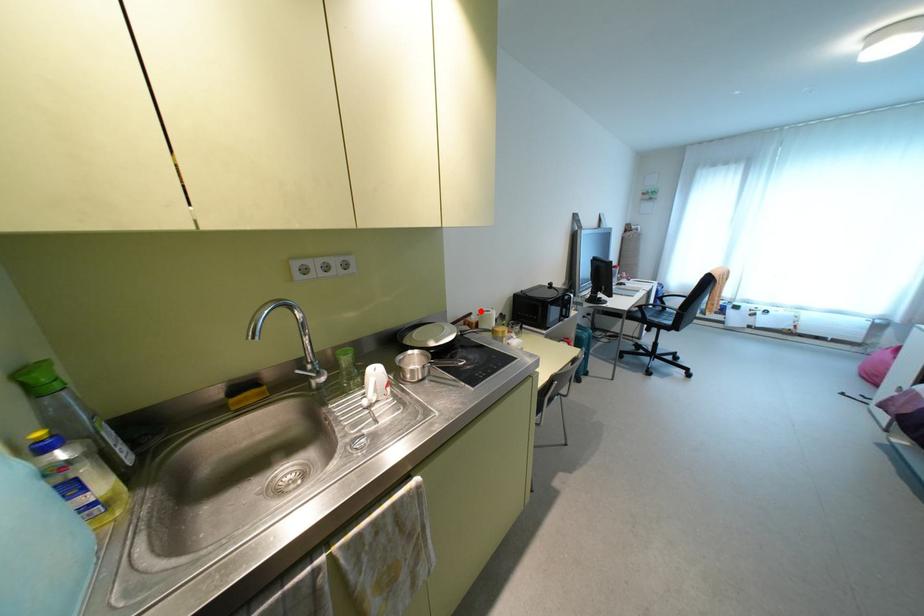
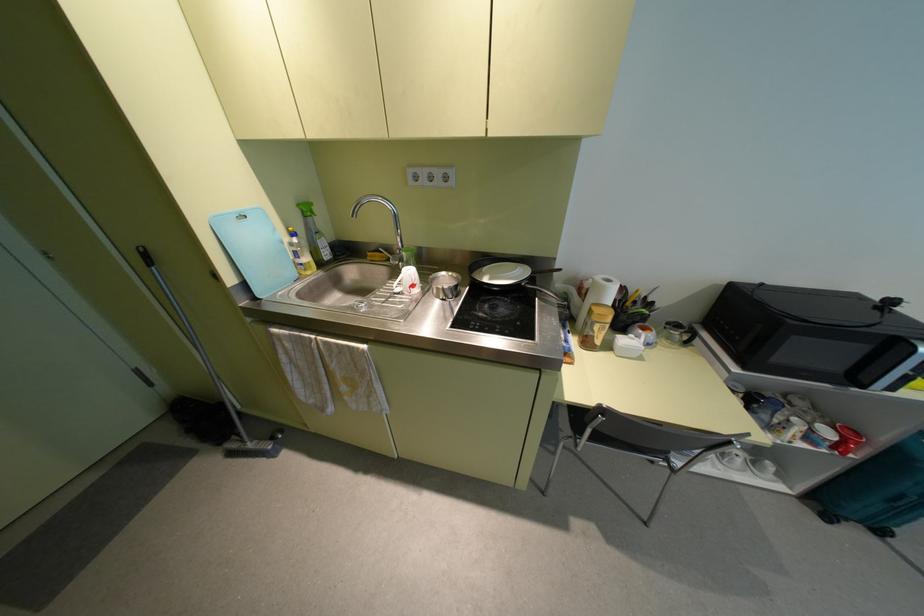
The point at the highlighted location is marked in the first image. Where is the corresponding point in the second image?

(599, 277)